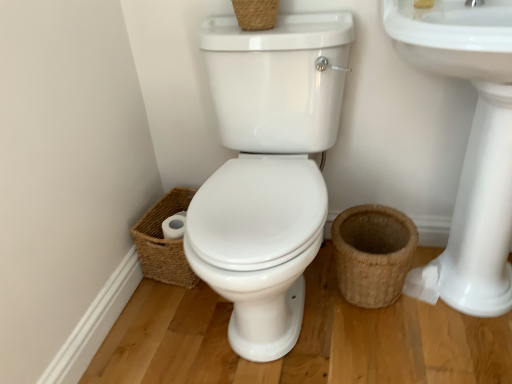
Find the location of a particular element. This screenshot has width=512, height=384. free space in front of woven brown basket at lower left, acting as the first basket starting from the left is located at coordinates (173, 317).